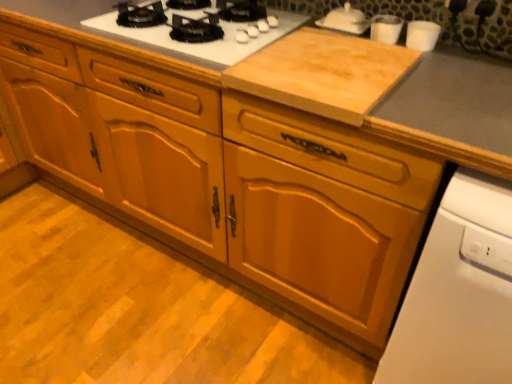
The image size is (512, 384). In order to click on free space to the left of clear glass cups at upper right, the 2th appliance viewed from the right in this screenshot , I will do `click(325, 38)`.